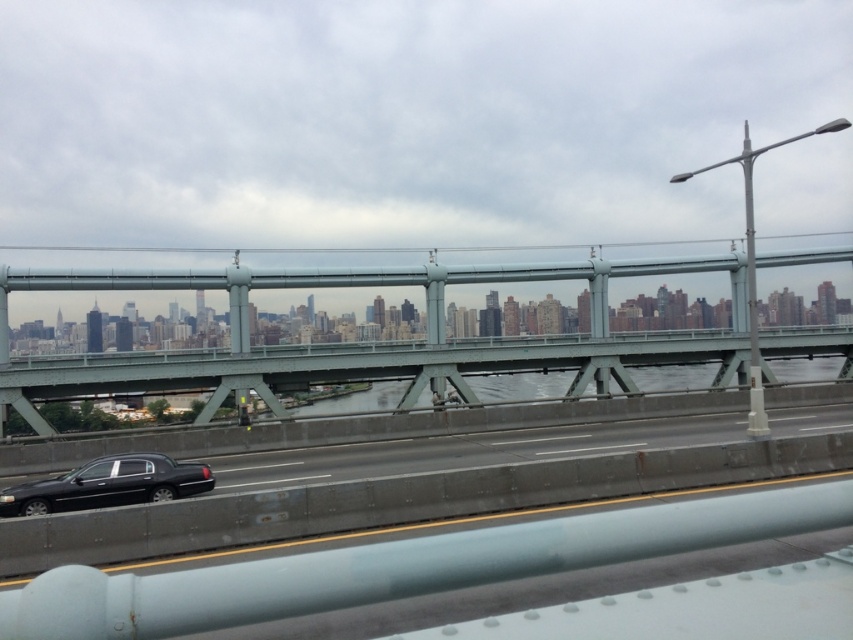
Can you confirm if green metallic bridge at center is taller than black glossy sedan at lower left?

Yes.

From the picture: Is green metallic bridge at center smaller than black glossy sedan at lower left?

No, green metallic bridge at center is not smaller than black glossy sedan at lower left.

Image resolution: width=853 pixels, height=640 pixels. Identify the location of green metallic bridge at center. (364, 342).

Is black glossy car at lower left positioned in front of black glossy sedan at lower left?

Yes, black glossy car at lower left is in front of black glossy sedan at lower left.

Does black glossy car at lower left appear under black glossy sedan at lower left?

Yes, black glossy car at lower left is below black glossy sedan at lower left.

Does point (9, 538) lie in front of point (194, 490)?

Yes, point (9, 538) is closer to viewer.

Locate an element on the screen. This screenshot has width=853, height=640. black glossy car at lower left is located at coordinates (399, 500).

Is green metallic bridge at center to the left of black glossy car at lower left from the viewer's perspective?

Incorrect, green metallic bridge at center is not on the left side of black glossy car at lower left.

Does green metallic bridge at center have a greater width compared to black glossy car at lower left?

Yes, green metallic bridge at center is wider than black glossy car at lower left.

Who is more forward, [173,380] or [747,477]?

Point [747,477] is more forward.

Locate an element on the screen. This screenshot has height=640, width=853. green metallic bridge at center is located at coordinates (364, 342).